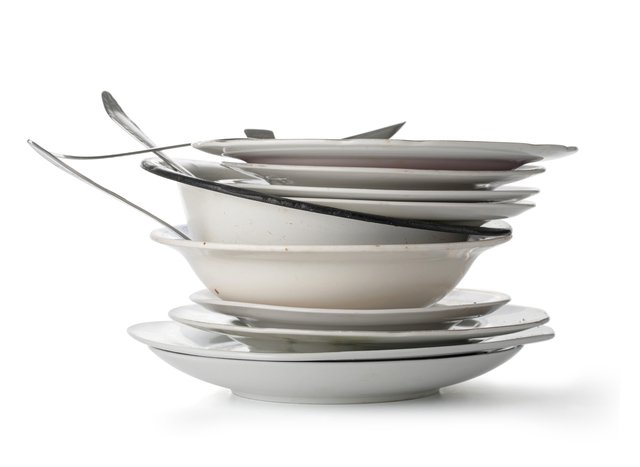
Identify the location of stacked plates and bowls. (386, 379), (402, 353), (404, 339), (406, 315), (400, 273), (346, 223), (477, 209), (484, 196), (459, 175), (472, 146).